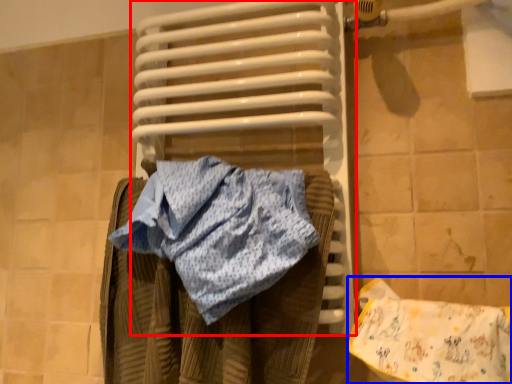
Question: Which object appears farthest to the camera in this image, water heater (highlighted by a red box) or material (highlighted by a blue box)?

Choices:
 (A) water heater
 (B) material

Answer: (A)